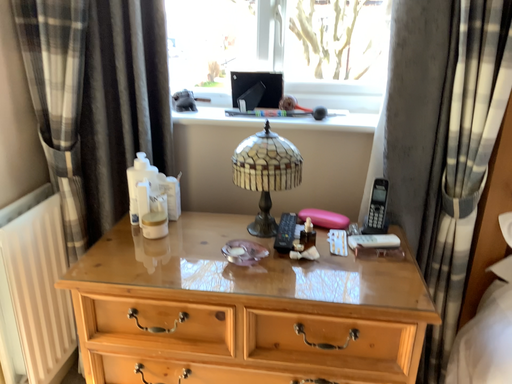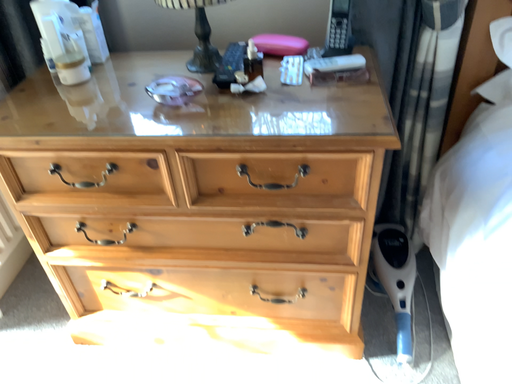
Question: Which way did the camera rotate in the video?

Choices:
 (A) rotated upward
 (B) rotated downward

Answer: (B)